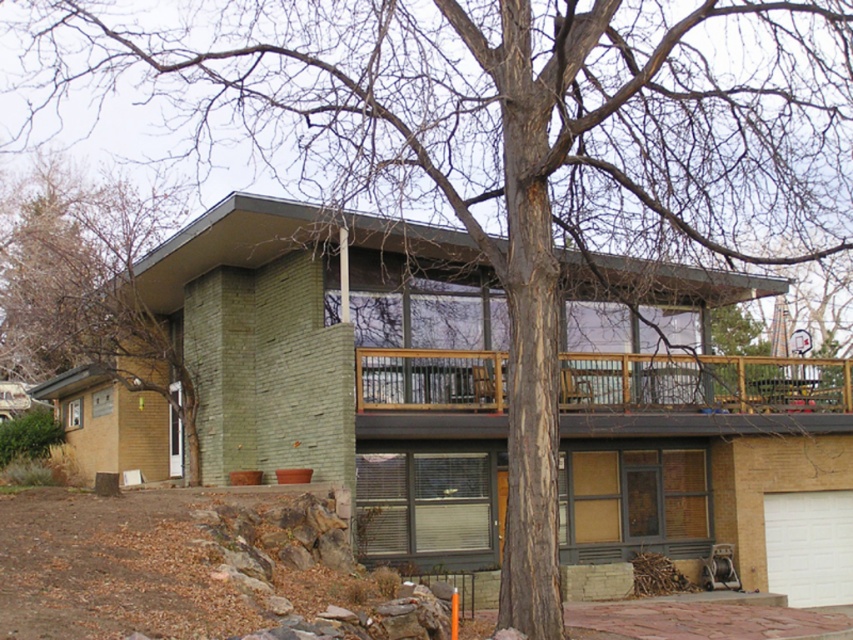
Question: Among these points, which one is nearest to the camera?

Choices:
 (A) [x=828, y=403]
 (B) [x=62, y=275]

Answer: (A)

Question: Is green textured wall at left closer to the viewer compared to wooden deck at upper center?

Choices:
 (A) no
 (B) yes

Answer: (A)

Question: Which object is closer to the camera taking this photo?

Choices:
 (A) wooden deck at upper center
 (B) green textured wall at left

Answer: (A)

Question: Can you confirm if green textured wall at left is positioned to the right of wooden deck at upper center?

Choices:
 (A) yes
 (B) no

Answer: (B)

Question: Does green textured wall at left appear on the left side of wooden deck at upper center?

Choices:
 (A) no
 (B) yes

Answer: (B)